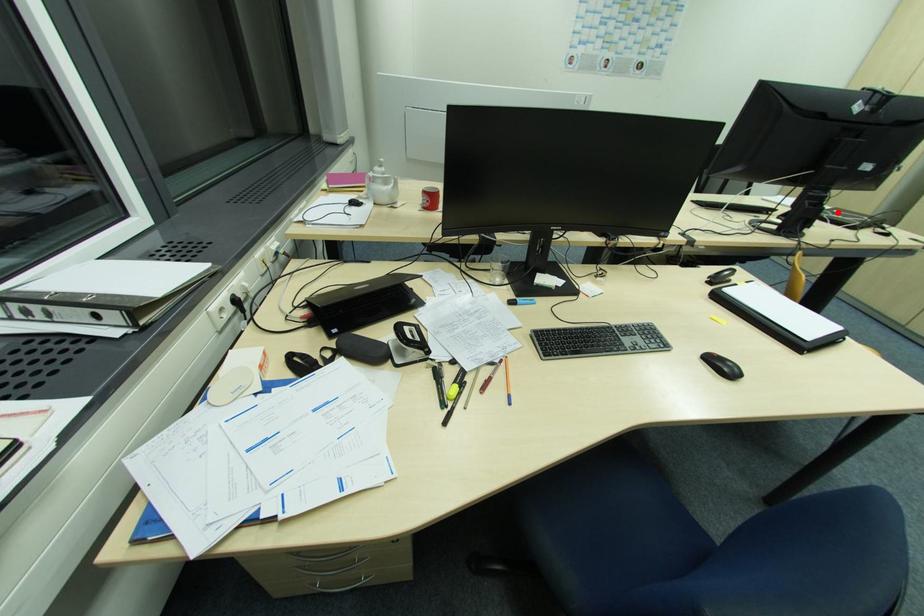
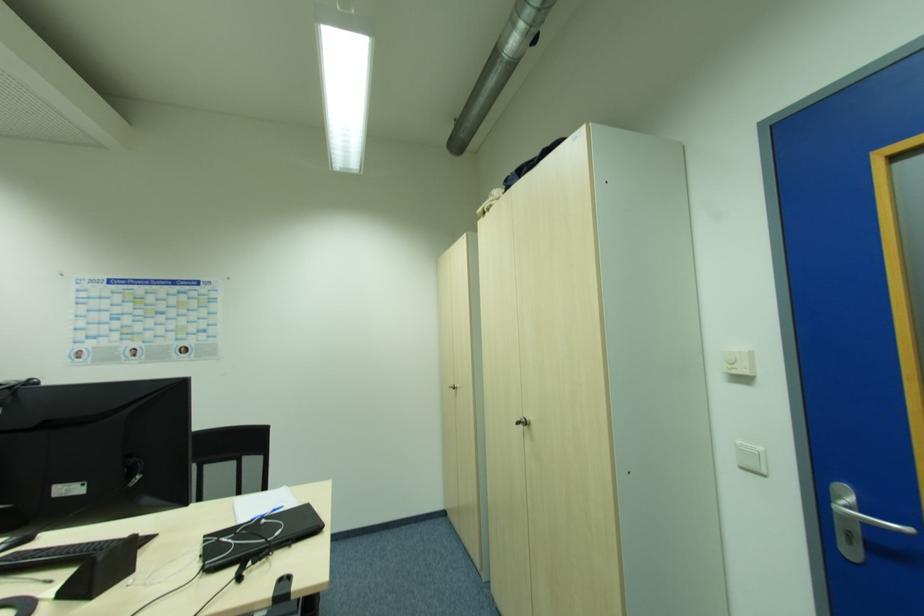
Question: A red point is marked in image1. In image2, is the corresponding 3D point closer to the camera or farther? Reply with the corresponding letter.

Choices:
 (A) The corresponding 3D point is closer.
 (B) The corresponding 3D point is farther.

Answer: (A)